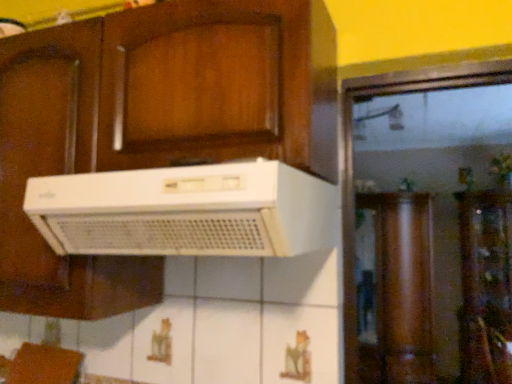
Where is `transparent glass cabinet at center`? transparent glass cabinet at center is located at coordinates (485, 286).

The height and width of the screenshot is (384, 512). Describe the element at coordinates (485, 286) in the screenshot. I see `transparent glass cabinet at center` at that location.

What are the coordinates of `white plastic range hood at center` in the screenshot? It's located at (185, 211).

What do you see at coordinates (185, 211) in the screenshot? The image size is (512, 384). I see `white plastic range hood at center` at bounding box center [185, 211].

In order to click on transparent glass cabinet at center in this screenshot , I will do `click(485, 286)`.

In the scene shown: Based on their positions, is transparent glass cabinet at center located to the left or right of white plastic range hood at center?

Based on their positions, transparent glass cabinet at center is located to the right of white plastic range hood at center.

Which object is further away from the camera taking this photo, transparent glass cabinet at center or white plastic range hood at center?

transparent glass cabinet at center.

Which is in front, point (467, 339) or point (244, 240)?

The point (244, 240) is closer.

From the image's perspective, is transparent glass cabinet at center under white plastic range hood at center?

Yes, from the image's perspective, transparent glass cabinet at center is beneath white plastic range hood at center.

From a real-world perspective, is transparent glass cabinet at center positioned over white plastic range hood at center based on gravity?

Actually, transparent glass cabinet at center is physically below white plastic range hood at center in the real world.

Is transparent glass cabinet at center wider or thinner than white plastic range hood at center?

Clearly, transparent glass cabinet at center has more width compared to white plastic range hood at center.

From their relative heights in the image, would you say transparent glass cabinet at center is taller or shorter than white plastic range hood at center?

transparent glass cabinet at center is taller than white plastic range hood at center.

Based on their sizes in the image, would you say transparent glass cabinet at center is bigger or smaller than white plastic range hood at center?

Clearly, transparent glass cabinet at center is larger in size than white plastic range hood at center.

Is transparent glass cabinet at center positioned beyond the bounds of white plastic range hood at center?

Yes, transparent glass cabinet at center is outside of white plastic range hood at center.

Would you consider transparent glass cabinet at center to be distant from white plastic range hood at center?

Yes, transparent glass cabinet at center and white plastic range hood at center are quite far apart.

Is transparent glass cabinet at center facing towards white plastic range hood at center?

No, transparent glass cabinet at center is not turned towards white plastic range hood at center.

How many degrees apart are the facing directions of transparent glass cabinet at center and white plastic range hood at center?

transparent glass cabinet at center and white plastic range hood at center are facing 0.000167 degrees away from each other.

Where is `cabinetry lying below the white plastic range hood at center (from the image's perspective)`? cabinetry lying below the white plastic range hood at center (from the image's perspective) is located at coordinates (485, 286).

Considering the relative positions of white plastic range hood at center and transparent glass cabinet at center in the image provided, is white plastic range hood at center to the right of transparent glass cabinet at center from the viewer's perspective?

Incorrect, white plastic range hood at center is not on the right side of transparent glass cabinet at center.

Is white plastic range hood at center positioned behind transparent glass cabinet at center?

No, white plastic range hood at center is closer to the camera.

Is point (142, 237) closer to camera compared to point (487, 366)?

Yes, it is in front of point (487, 366).

From the image's perspective, is white plastic range hood at center below transparent glass cabinet at center?

No, from the image's perspective, white plastic range hood at center is not below transparent glass cabinet at center.

From a real-world perspective, does white plastic range hood at center sit lower than transparent glass cabinet at center?

Incorrect, from a real-world perspective, white plastic range hood at center is higher than transparent glass cabinet at center.

Which of these two, white plastic range hood at center or transparent glass cabinet at center, is thinner?

Thinner between the two is white plastic range hood at center.

Does white plastic range hood at center have a greater height compared to transparent glass cabinet at center?

No.

Considering the sizes of objects white plastic range hood at center and transparent glass cabinet at center in the image provided, who is smaller, white plastic range hood at center or transparent glass cabinet at center?

Smaller between the two is white plastic range hood at center.

Would you say white plastic range hood at center is outside transparent glass cabinet at center?

white plastic range hood at center lies outside transparent glass cabinet at center's area.

Does white plastic range hood at center touch transparent glass cabinet at center?

No, white plastic range hood at center is not next to transparent glass cabinet at center.

Is white plastic range hood at center facing away from transparent glass cabinet at center?

Yes, transparent glass cabinet at center is at the back of white plastic range hood at center.

Consider the image. What's the angular difference between white plastic range hood at center and transparent glass cabinet at center's facing directions?

0.000167 degrees separate the facing orientations of white plastic range hood at center and transparent glass cabinet at center.

Locate an element on the screen. Image resolution: width=512 pixels, height=384 pixels. cabinetry located behind the white plastic range hood at center is located at coordinates (485, 286).

Where is `home appliance above the transparent glass cabinet at center (from a real-world perspective)`? home appliance above the transparent glass cabinet at center (from a real-world perspective) is located at coordinates (185, 211).

What are the coordinates of `cabinetry on the right of the white plastic range hood at center` in the screenshot? It's located at (485, 286).